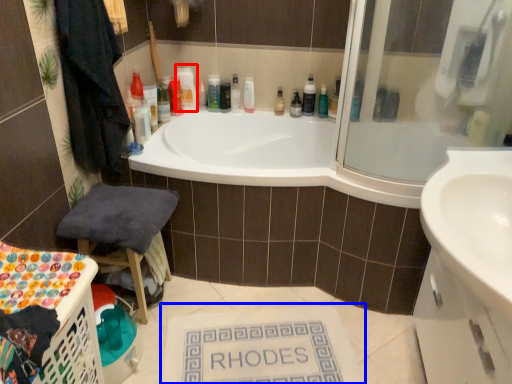
Question: Which point is closer to the camera, cleaning product (highlighted by a red box) or bath mat (highlighted by a blue box)?

Choices:
 (A) cleaning product
 (B) bath mat

Answer: (B)